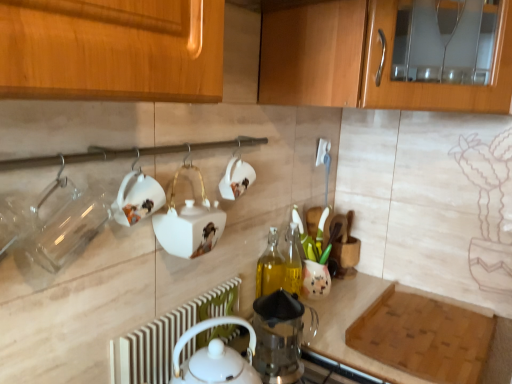
Find the location of a particular element. Image resolution: width=512 pixels, height=384 pixels. empty space that is to the right of matte ceramic tea set at center right, positioned as the 2th tea set in left-to-right order is located at coordinates (355, 294).